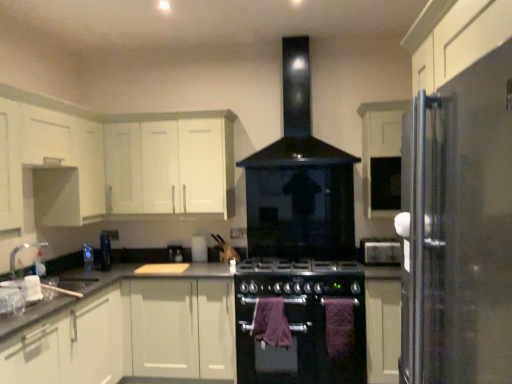
Question: Is purple cotton towel at lower center, which appears as the 2th blanket when viewed from the left, wider than white matte cabinet at lower right, the 2th cabinetry positioned from the right?

Choices:
 (A) yes
 (B) no

Answer: (B)

Question: Is purple cotton towel at lower center, placed as the first blanket when sorted from right to left, positioned with its back to white matte cabinet at lower right, the 2th cabinetry positioned from the right?

Choices:
 (A) yes
 (B) no

Answer: (B)

Question: Is purple cotton towel at lower center, which appears as the 2th blanket when viewed from the left, facing towards white matte cabinet at lower right, which is the 4th cabinetry from left to right?

Choices:
 (A) no
 (B) yes

Answer: (A)

Question: Can you see purple cotton towel at lower center, placed as the first blanket when sorted from right to left, touching white matte cabinet at lower right, which is the 4th cabinetry from left to right?

Choices:
 (A) yes
 (B) no

Answer: (B)

Question: From a real-world perspective, is purple cotton towel at lower center, which appears as the 2th blanket when viewed from the left, positioned under white matte cabinet at lower right, the 2th cabinetry positioned from the right, based on gravity?

Choices:
 (A) yes
 (B) no

Answer: (B)

Question: Does purple cotton towel at lower center, which appears as the 2th blanket when viewed from the left, have a larger size compared to white matte cabinet at lower right, the 2th cabinetry positioned from the right?

Choices:
 (A) no
 (B) yes

Answer: (A)

Question: From the image's perspective, is white matte cabinet at upper left, which is the 3th cabinetry in right-to-left order, above purple fabric towel at center, marked as the first blanket in a left-to-right arrangement?

Choices:
 (A) no
 (B) yes

Answer: (B)

Question: Can you confirm if white matte cabinet at upper left, the 3th cabinetry from the left, is thinner than purple fabric towel at center, the second blanket in the right-to-left sequence?

Choices:
 (A) yes
 (B) no

Answer: (B)

Question: Is the depth of white matte cabinet at upper left, the 3th cabinetry from the left, greater than that of purple fabric towel at center, marked as the first blanket in a left-to-right arrangement?

Choices:
 (A) yes
 (B) no

Answer: (A)

Question: Can you confirm if white matte cabinet at upper left, the 3th cabinetry from the left, is shorter than purple fabric towel at center, marked as the first blanket in a left-to-right arrangement?

Choices:
 (A) no
 (B) yes

Answer: (A)

Question: Is there a large distance between white matte cabinet at upper left, the 3th cabinetry from the left, and purple fabric towel at center, marked as the first blanket in a left-to-right arrangement?

Choices:
 (A) yes
 (B) no

Answer: (A)

Question: Can you confirm if white matte cabinet at upper left, the 3th cabinetry from the left, is smaller than purple fabric towel at center, marked as the first blanket in a left-to-right arrangement?

Choices:
 (A) yes
 (B) no

Answer: (B)

Question: From a real-world perspective, is satin black kettle at center, which appears as the 1th appliance when viewed from the back, located beneath black matte oven at center?

Choices:
 (A) yes
 (B) no

Answer: (B)